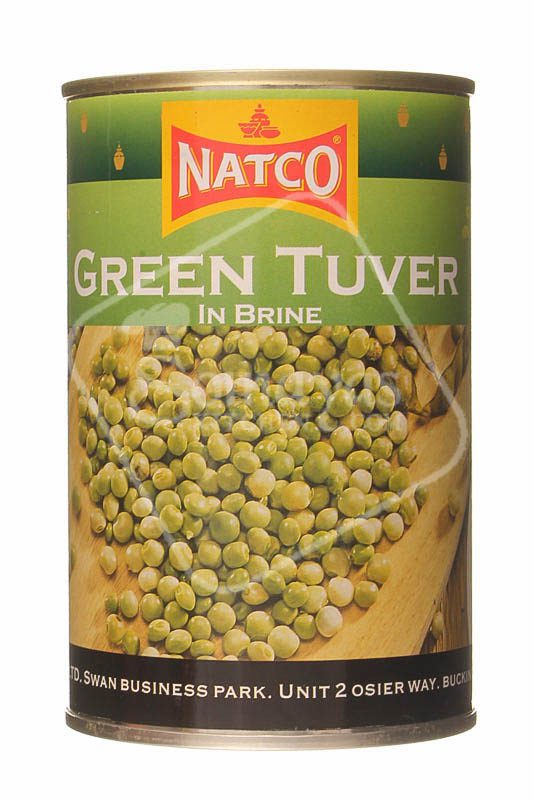
Where is `bowl icon`? The image size is (533, 800). bowl icon is located at coordinates (244, 129).